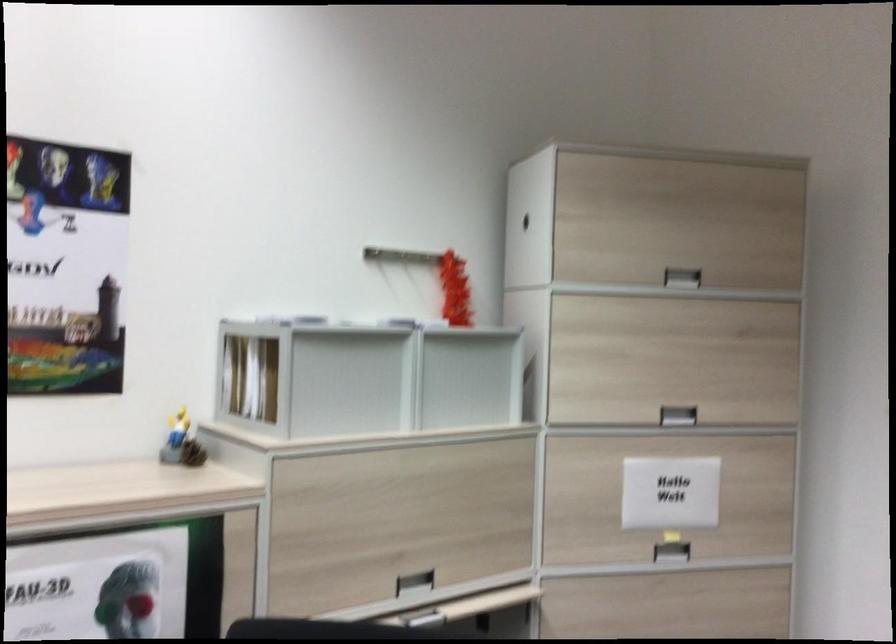
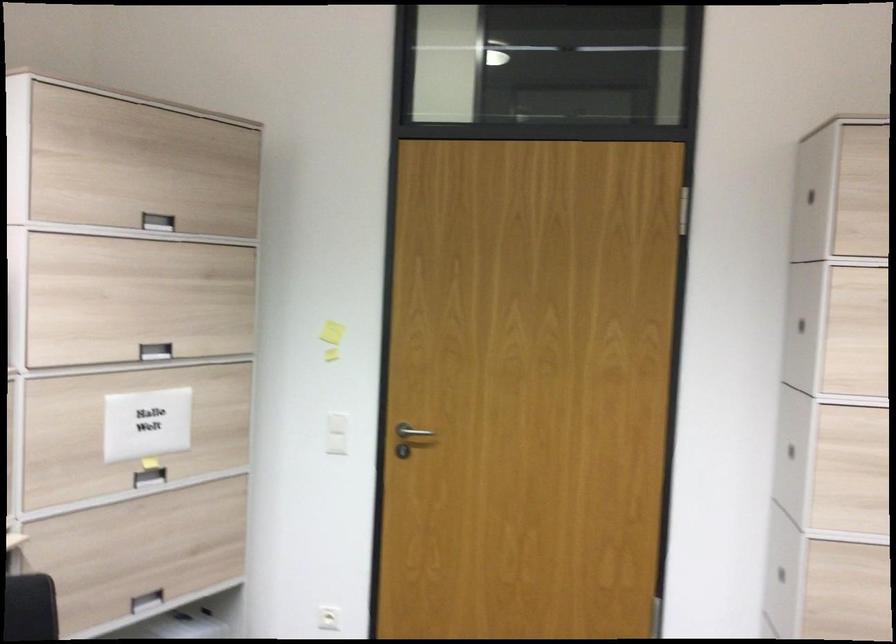
Question: The camera is either moving clockwise (left) or counter-clockwise (right) around the object. The first image is from the beginning of the video and the second image is from the end. Is the camera moving left or right when shooting the video?

Choices:
 (A) Left
 (B) Right

Answer: (A)